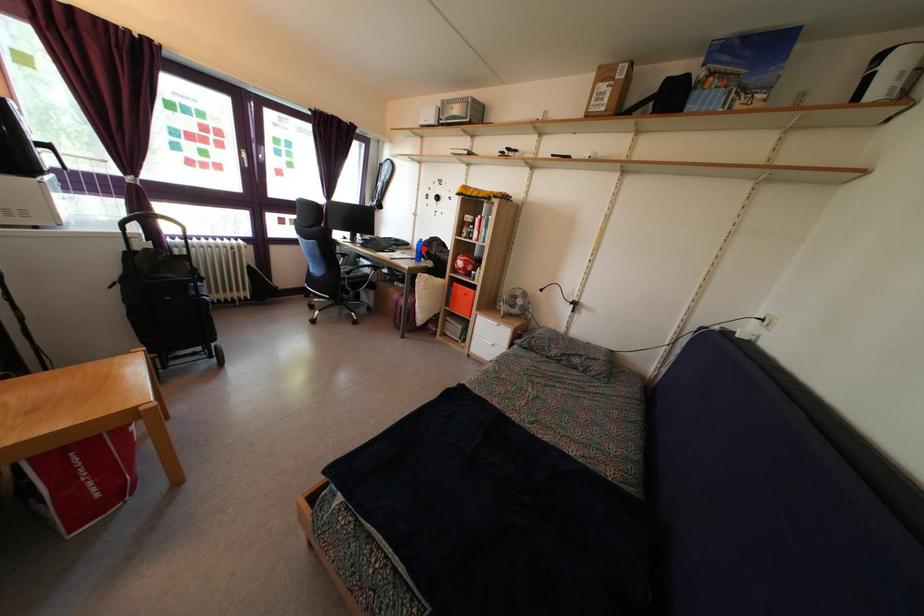
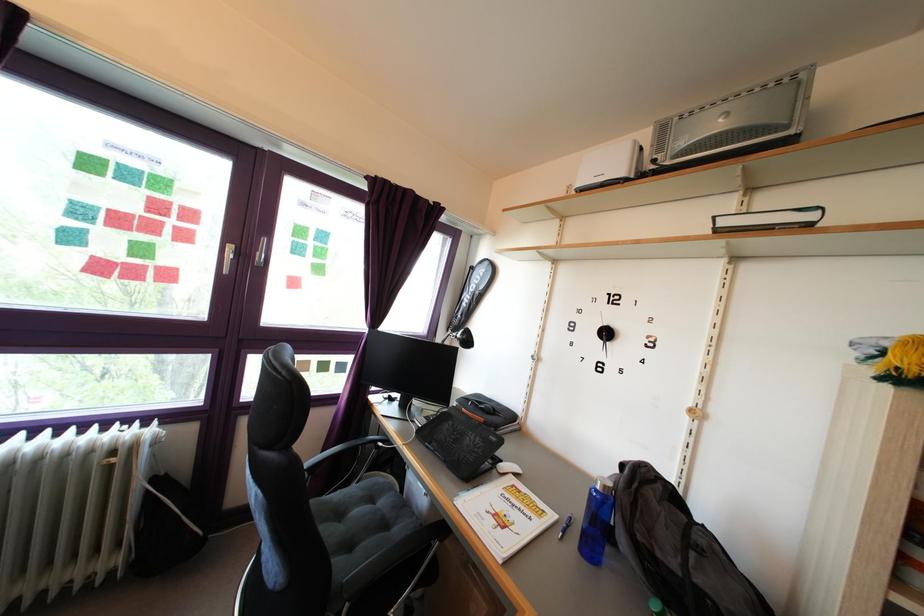
Question: A red point is marked in image1. In image2, is the corresponding 3D point closer to the camera or farther? Reply with the corresponding letter.

Choices:
 (A) The corresponding 3D point is closer.
 (B) The corresponding 3D point is farther.

Answer: (B)